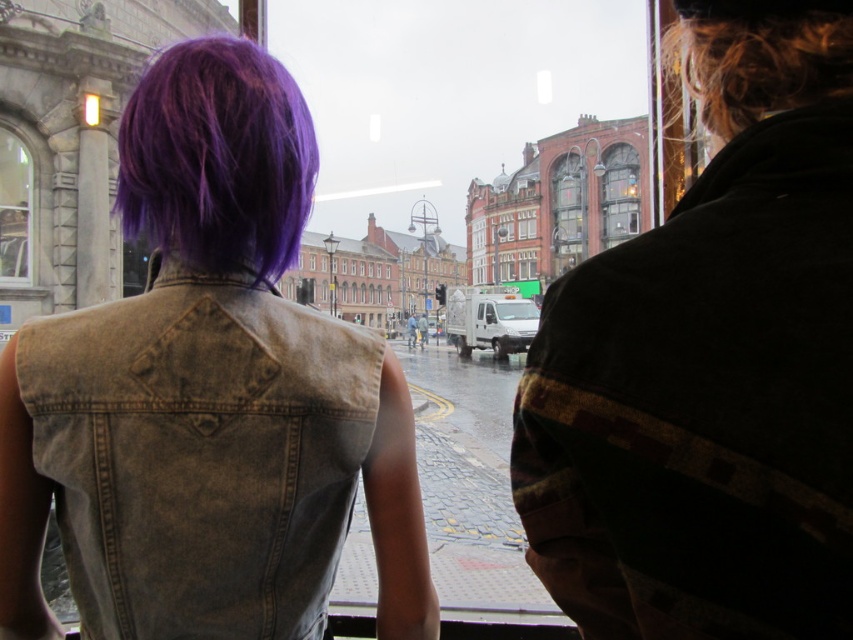
Consider the image. Between purple hair at upper left and glass window at center, which one has less height?

With less height is purple hair at upper left.

Between purple hair at upper left and glass window at center, which one has more height?

glass window at center is taller.

In order to click on purple hair at upper left in this screenshot , I will do `click(218, 157)`.

Which is in front, point (212, 180) or point (577, 204)?

Point (212, 180)

Measure the distance between point (244, 60) and camera.

127.97 feet

At what (x,y) coordinates should I click in order to perform the action: click on purple hair at upper left. Please return your answer as a coordinate pair (x, y). Looking at the image, I should click on (218, 157).

Looking at this image, measure the distance from purple matte hair at upper left to blonde curly hair at upper right.

A distance of 24.66 meters exists between purple matte hair at upper left and blonde curly hair at upper right.

Describe the element at coordinates (207, 396) in the screenshot. I see `purple matte hair at upper left` at that location.

This screenshot has width=853, height=640. Find the location of `purple matte hair at upper left`. purple matte hair at upper left is located at coordinates (207, 396).